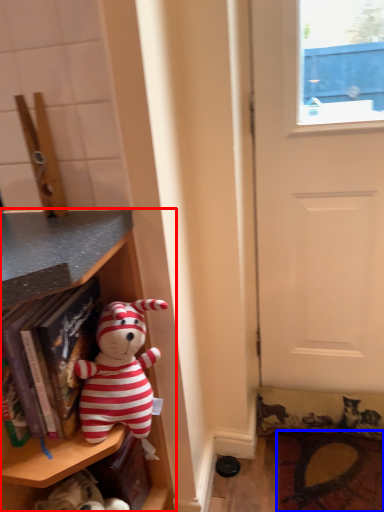
Question: Which point is further to the camera, shelf (highlighted by a red box) or doormat (highlighted by a blue box)?

Choices:
 (A) shelf
 (B) doormat

Answer: (B)